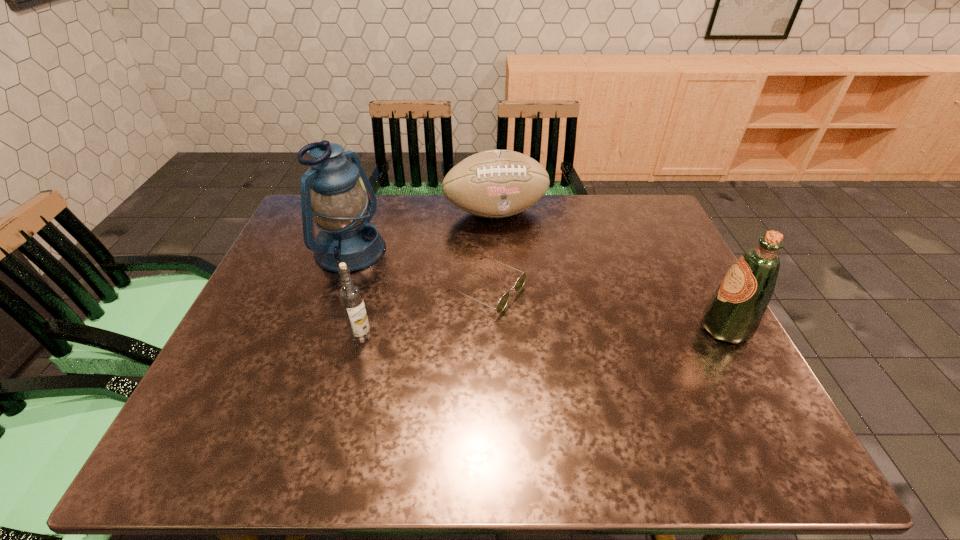
At what (x,y) coordinates should I click in order to perform the action: click on free space that satisfies the following two spatial constraints: 1. on the front side of the tallest object; 2. on the left side of the sunglasses. Please return your answer as a coordinate pair (x, y). This screenshot has height=540, width=960. Looking at the image, I should click on (337, 289).